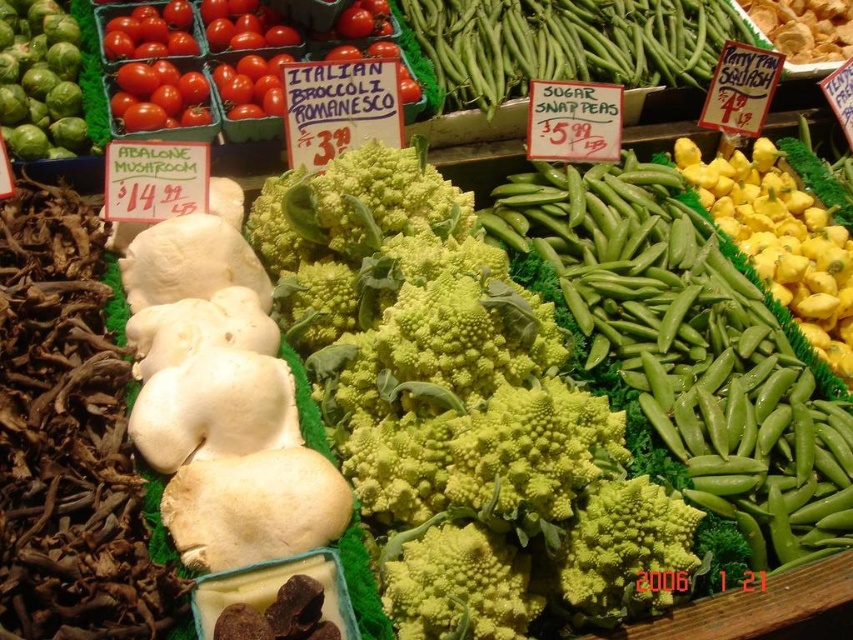
Question: Is green snap peas at center thinner than yellow-green smooth squash at right?

Choices:
 (A) no
 (B) yes

Answer: (A)

Question: Can you confirm if yellow-green smooth squash at right is positioned above green matte brussels sprouts at left?

Choices:
 (A) yes
 (B) no

Answer: (B)

Question: Which point is farther from the camera taking this photo?

Choices:
 (A) (793, 216)
 (B) (62, 97)

Answer: (A)

Question: Can you confirm if green rough broccoli at center is bigger than green smooth sugar snap peas at center?

Choices:
 (A) yes
 (B) no

Answer: (B)

Question: Which point is closer to the camera taking this photo?

Choices:
 (A) (438, 406)
 (B) (19, 115)
 (C) (489, 42)

Answer: (A)

Question: Considering the real-world distances, which object is farthest from the yellow-green smooth squash at right?

Choices:
 (A) green rough broccoli at center
 (B) green snap peas at center
 (C) green smooth sugar snap peas at center

Answer: (A)